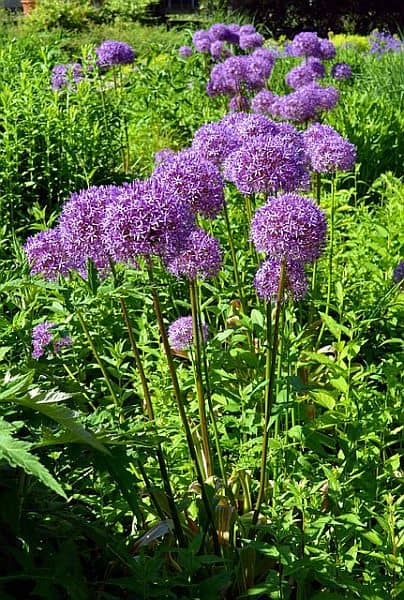
Where is `flower pot`? The width and height of the screenshot is (404, 600). flower pot is located at coordinates (28, 5).